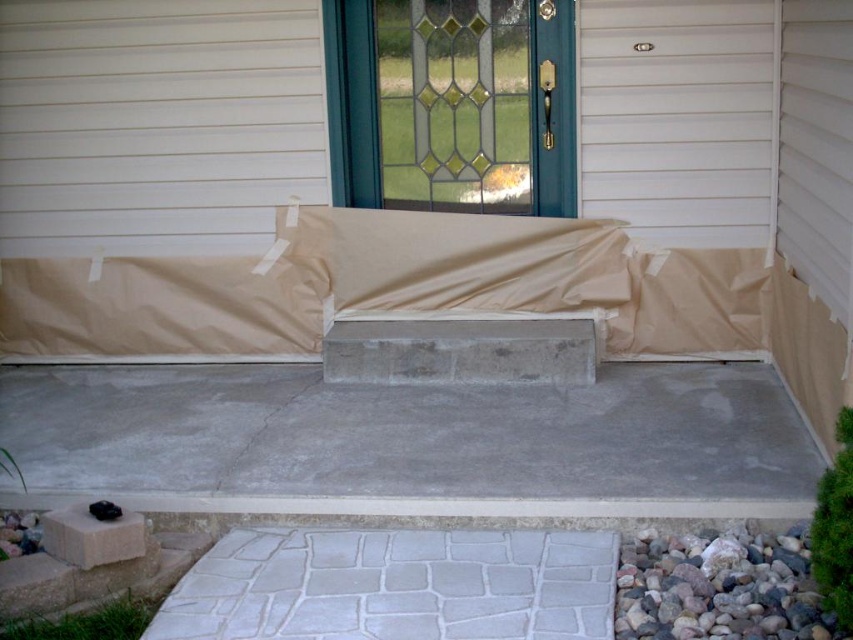
Is gray stone-like at lower center positioned at the back of white painted wood door at upper center?

No, gray stone-like at lower center is in front of white painted wood door at upper center.

Consider the image. Can you confirm if gray stone-like at lower center is positioned to the left of white painted wood door at upper center?

Indeed, gray stone-like at lower center is positioned on the left side of white painted wood door at upper center.

Who is more distant from viewer, (334, 532) or (651, 230)?

The point (651, 230) is more distant.

Identify the location of gray stone-like at lower center. The image size is (853, 640). (395, 586).

Who is higher up, gray stone-like at lower center or gold polished brass door handle at center?

Positioned higher is gold polished brass door handle at center.

Does point (550, 627) come closer to viewer compared to point (540, 156)?

Yes, point (550, 627) is in front of point (540, 156).

What do you see at coordinates (395, 586) in the screenshot?
I see `gray stone-like at lower center` at bounding box center [395, 586].

You are a GUI agent. You are given a task and a screenshot of the screen. Output one action in this format:
    pyautogui.click(x=<x>, y=<y>)
    Task: Click on the gray stone-like at lower center
    The height and width of the screenshot is (640, 853).
    Given the screenshot: What is the action you would take?
    pyautogui.click(x=395, y=586)

Which is more to the left, white painted wood door at upper center or gray rock at lower right?

gray rock at lower right is more to the left.

This screenshot has width=853, height=640. What do you see at coordinates (677, 116) in the screenshot?
I see `white painted wood door at upper center` at bounding box center [677, 116].

Is point (619, 29) more distant than point (654, 595)?

Yes, it is behind point (654, 595).

The width and height of the screenshot is (853, 640). What are the coordinates of `white painted wood door at upper center` in the screenshot? It's located at (677, 116).